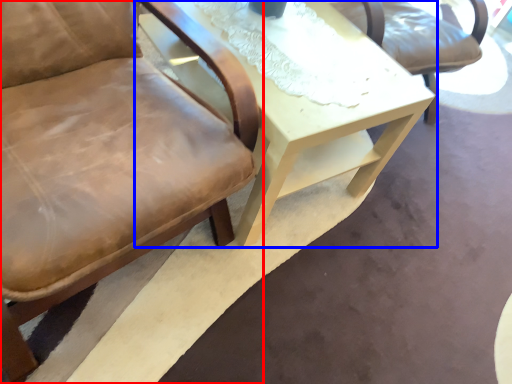
Question: Which object appears closest to the camera in this image, chair (highlighted by a red box) or table (highlighted by a blue box)?

Choices:
 (A) chair
 (B) table

Answer: (A)